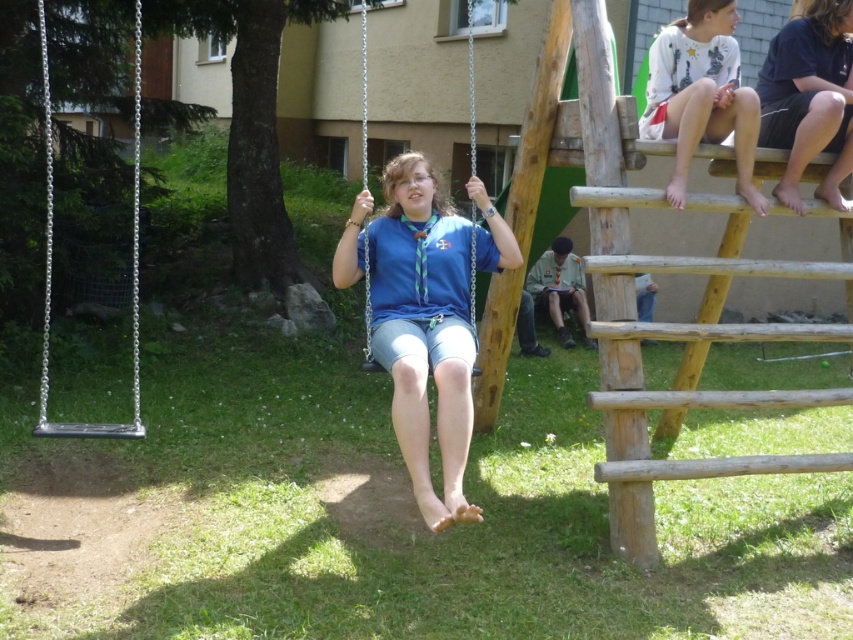
From the picture: Between blue cotton shirt at center and blue fabric swing at center, which one is positioned higher?

blue fabric swing at center is higher up.

Who is more distant from viewer, (409, 388) or (471, 321)?

The point (471, 321) is behind.

Where is `blue cotton shirt at center`? The height and width of the screenshot is (640, 853). blue cotton shirt at center is located at coordinates point(424,330).

Does silver metallic swing at left appear under blue fabric swing at center?

Yes.

Is silver metallic swing at left to the left of blue fabric swing at center from the viewer's perspective?

Yes, silver metallic swing at left is to the left of blue fabric swing at center.

This screenshot has height=640, width=853. Describe the element at coordinates (131, 257) in the screenshot. I see `silver metallic swing at left` at that location.

You are a GUI agent. You are given a task and a screenshot of the screen. Output one action in this format:
    pyautogui.click(x=<x>, y=<y>)
    Task: Click on the silver metallic swing at left
    
    Given the screenshot: What is the action you would take?
    pyautogui.click(x=131, y=257)

Is white cotton shirt at upper right shorter than blue fabric swing at center?

Indeed, white cotton shirt at upper right has a lesser height compared to blue fabric swing at center.

Does white cotton shirt at upper right have a greater height compared to blue fabric swing at center?

In fact, white cotton shirt at upper right may be shorter than blue fabric swing at center.

Does point (680, 154) come closer to viewer compared to point (469, 90)?

Yes, it is.

The image size is (853, 640). What are the coordinates of `white cotton shirt at upper right` in the screenshot? It's located at pyautogui.click(x=701, y=96).